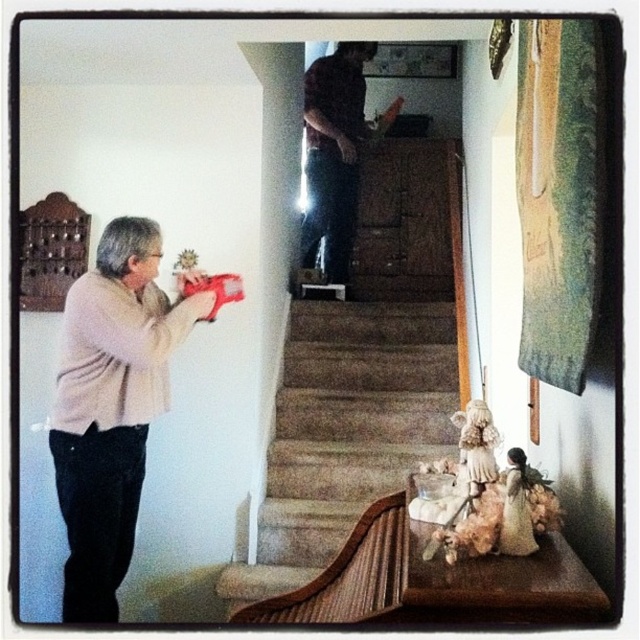
You are a delivery person trying to reach the door at the top of the carpeted stairs at center. The dark brown shirt at upper center belongs to a person blocking your path. Can you go around them to reach the stairs?

The carpeted stairs at center is positioned under dark brown shirt at upper center, so the person wearing the dark brown shirt at upper center is standing above the stairs. You can go around them to reach the stairs as they are blocking the path from above.

You are a person who is 1.7 meters tall. You are standing in the house and looking at the carpeted stairs at center and the beige sweater at left. Which object is taller?

The beige sweater at left is taller than the carpeted stairs at center.

You are standing at the bottom of the staircase and want to reach the point marked as point (353, 182). However, there is an obstacle at point (323, 460). Can you walk directly to your destination without going around the obstacle?

Point (323, 460) is in front of point (353, 182), so the obstacle is blocking the path. You will need to go around it to reach your destination.